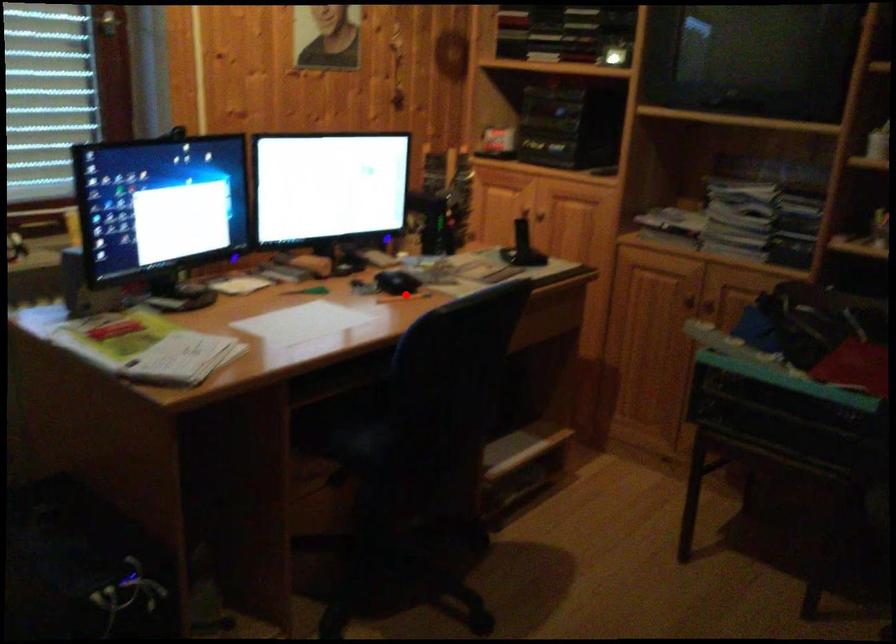
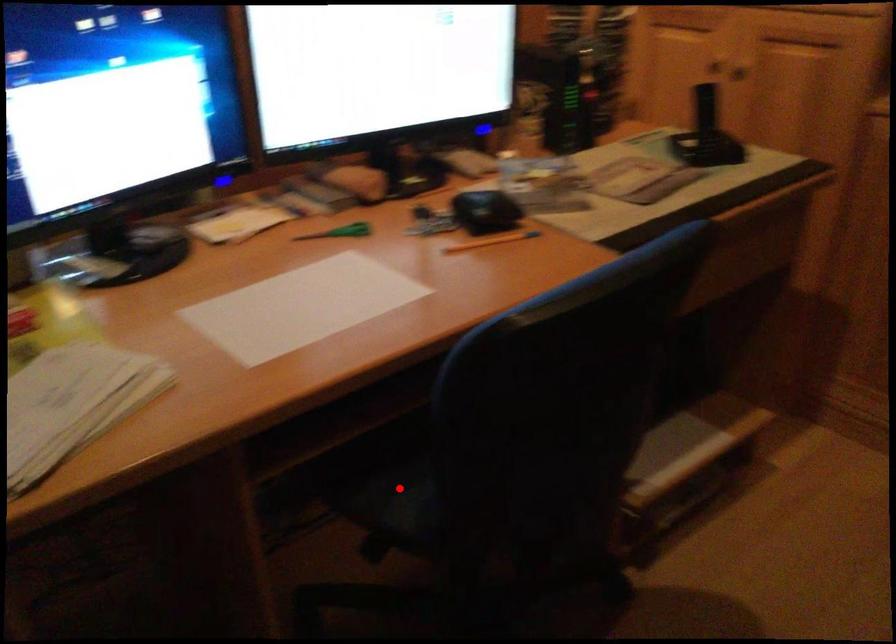
I am providing you with two images of the same scene from different viewpoints. A red point is marked on the first image and another point is marked on the second image. Are the points marked in image1 and image2 representing the same 3D position?

No